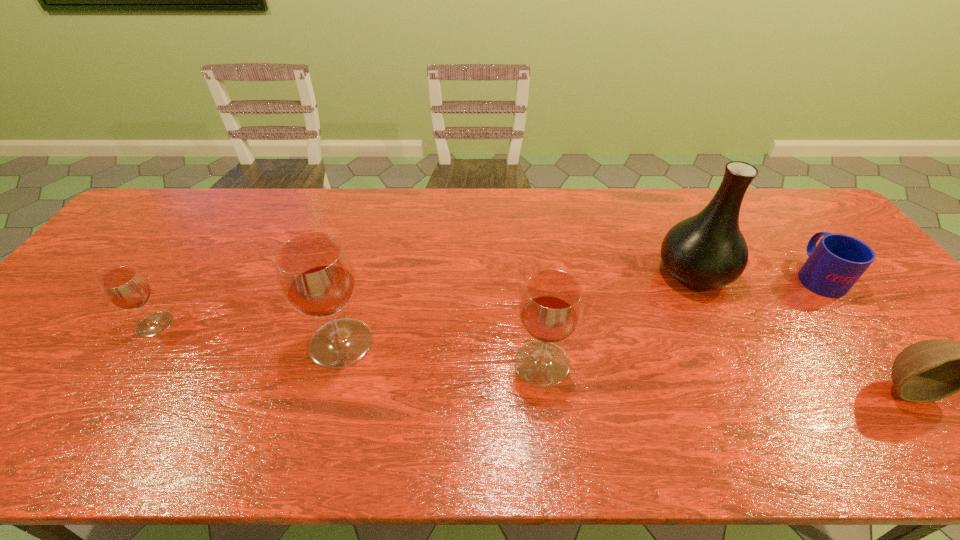
At what (x,y) coordinates should I click in order to perform the action: click on vacant space located 0.070m on the left of the fourth shortest object. Please return your answer as a coordinate pair (x, y). The height and width of the screenshot is (540, 960). Looking at the image, I should click on (484, 363).

Where is `vacant space situated on the side with the handle of the shortest object`? vacant space situated on the side with the handle of the shortest object is located at coordinates (775, 220).

Find the location of `free point located on the side with the handle of the shortest object`. free point located on the side with the handle of the shortest object is located at coordinates (751, 189).

Find the location of a particular element. The image size is (960, 540). free space located on the side with the handle of the shortest object is located at coordinates (774, 219).

I want to click on vacant area situated 0.070m on the back of the bowl, so click(x=875, y=346).

Identify the location of vacant space located on the right of the fourth object from left to right. The height and width of the screenshot is (540, 960). (760, 273).

In order to click on wineglass that is at the near edge in this screenshot , I will do `click(551, 305)`.

Locate an element on the screen. bowl present at the near edge is located at coordinates (931, 370).

Where is `mug located in the right edge section of the desktop`? The image size is (960, 540). mug located in the right edge section of the desktop is located at coordinates (833, 266).

This screenshot has height=540, width=960. I want to click on bowl present at the right edge, so click(931, 370).